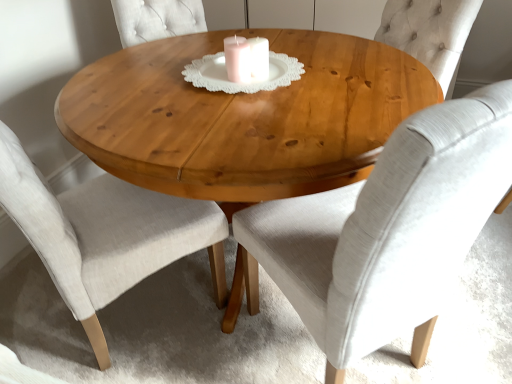
This screenshot has width=512, height=384. Describe the element at coordinates (105, 234) in the screenshot. I see `light beige fabric chair at center, the second chair from the right` at that location.

You are a GUI agent. You are given a task and a screenshot of the screen. Output one action in this format:
    pyautogui.click(x=<x>, y=<y>)
    Task: Click on the light gray fabric chair at center, which is the second chair from left to right
    The image size is (512, 384).
    Given the screenshot: What is the action you would take?
    pyautogui.click(x=387, y=230)

Identify the location of light beige fabric chair at center, the second chair from the right. (105, 234).

In terms of size, does natural wood table at center appear bigger or smaller than light gray fabric chair at center, which is the second chair from left to right?

Clearly, natural wood table at center is larger in size than light gray fabric chair at center, which is the second chair from left to right.

Locate an element on the screen. chair on the right of natural wood table at center is located at coordinates (387, 230).

Is light beige fabric chair at center, positioned as the first chair in left-to-right order, facing towards natural wood table at center?

Yes.

What's the angular difference between light beige fabric chair at center, positioned as the first chair in left-to-right order, and natural wood table at center's facing directions?

The facing directions of light beige fabric chair at center, positioned as the first chair in left-to-right order, and natural wood table at center are 148 degrees apart.

Is light beige fabric chair at center, the second chair from the right, inside the boundaries of natural wood table at center, or outside?

light beige fabric chair at center, the second chair from the right, lies within the bounds of natural wood table at center.

Is the position of light gray fabric chair at center, which is counted as the 1th chair, starting from the right, more distant than that of natural wood table at center?

No, light gray fabric chair at center, which is counted as the 1th chair, starting from the right, is closer to the camera.

Who is shorter, light gray fabric chair at center, which is the second chair from left to right, or natural wood table at center?

Standing shorter between the two is natural wood table at center.

In the scene shown: Can you confirm if light gray fabric chair at center, which is counted as the 1th chair, starting from the right, is smaller than natural wood table at center?

Yes, light gray fabric chair at center, which is counted as the 1th chair, starting from the right, is smaller than natural wood table at center.

Which chair is the 2nd one when counting from the front of the natural wood table at center? Please provide its 2D coordinates.

[(387, 230)]

From a real-world perspective, is light gray fabric chair at center, which is the second chair from left to right, positioned under light beige fabric chair at center, the second chair from the right, based on gravity?

No, from a real-world perspective, light gray fabric chair at center, which is the second chair from left to right, is not below light beige fabric chair at center, the second chair from the right.

From the picture: Which object is closer to the camera, light gray fabric chair at center, which is the second chair from left to right, or light beige fabric chair at center, positioned as the first chair in left-to-right order?

light gray fabric chair at center, which is the second chair from left to right.

Is light gray fabric chair at center, which is counted as the 1th chair, starting from the right, directly adjacent to light beige fabric chair at center, the second chair from the right?

No, light gray fabric chair at center, which is counted as the 1th chair, starting from the right, is not touching light beige fabric chair at center, the second chair from the right.

From the picture: Is natural wood table at center positioned with its back to light beige fabric chair at center, positioned as the first chair in left-to-right order?

No, light beige fabric chair at center, positioned as the first chair in left-to-right order, is not at the back of natural wood table at center.

Which is behind, natural wood table at center or light beige fabric chair at center, positioned as the first chair in left-to-right order?

natural wood table at center is behind.

Is light beige fabric chair at center, positioned as the first chair in left-to-right order, located within natural wood table at center?

Yes, natural wood table at center is surrounding light beige fabric chair at center, positioned as the first chair in left-to-right order.

Where is `chair that is the 1st one above the natural wood table at center (from a real-world perspective)`? chair that is the 1st one above the natural wood table at center (from a real-world perspective) is located at coordinates (105, 234).

Is light beige fabric chair at center, the second chair from the right, not close to light gray fabric chair at center, which is the second chair from left to right?

They are positioned close to each other.

Is light beige fabric chair at center, positioned as the first chair in left-to-right order, aimed at light gray fabric chair at center, which is counted as the 1th chair, starting from the right?

No, light beige fabric chair at center, positioned as the first chair in left-to-right order, does not turn towards light gray fabric chair at center, which is counted as the 1th chair, starting from the right.

Does light beige fabric chair at center, the second chair from the right, appear on the left side of light gray fabric chair at center, which is the second chair from left to right?

Yes.

Where is `chair to the right of natural wood table at center`? Image resolution: width=512 pixels, height=384 pixels. chair to the right of natural wood table at center is located at coordinates (387, 230).

Identify the location of chair on the left of natural wood table at center. Image resolution: width=512 pixels, height=384 pixels. (105, 234).

Estimate the real-world distances between objects in this image. Which object is further from light beige fabric chair at center, the second chair from the right, light gray fabric chair at center, which is the second chair from left to right, or natural wood table at center?

The object further to light beige fabric chair at center, the second chair from the right, is light gray fabric chair at center, which is the second chair from left to right.

Estimate the real-world distances between objects in this image. Which object is closer to light beige fabric chair at center, the second chair from the right, natural wood table at center or light gray fabric chair at center, which is counted as the 1th chair, starting from the right?

Based on the image, natural wood table at center appears to be nearer to light beige fabric chair at center, the second chair from the right.

From the picture: Based on their spatial positions, is light beige fabric chair at center, the second chair from the right, or natural wood table at center closer to light gray fabric chair at center, which is the second chair from left to right?

The object closer to light gray fabric chair at center, which is the second chair from left to right, is natural wood table at center.

When comparing their distances from natural wood table at center, does light beige fabric chair at center, the second chair from the right, or light gray fabric chair at center, which is counted as the 1th chair, starting from the right, seem further?

light beige fabric chair at center, the second chair from the right, is positioned further to the anchor natural wood table at center.

Looking at the image, which one is located closer to light gray fabric chair at center, which is the second chair from left to right, natural wood table at center or light beige fabric chair at center, the second chair from the right?

natural wood table at center is positioned closer to the anchor light gray fabric chair at center, which is the second chair from left to right.

Considering their positions, is light gray fabric chair at center, which is counted as the 1th chair, starting from the right, positioned closer to natural wood table at center than light beige fabric chair at center, positioned as the first chair in left-to-right order?

Based on the image, light gray fabric chair at center, which is counted as the 1th chair, starting from the right, appears to be nearer to natural wood table at center.

Image resolution: width=512 pixels, height=384 pixels. What are the coordinates of `coffee table located between light beige fabric chair at center, positioned as the first chair in left-to-right order, and light gray fabric chair at center, which is the second chair from left to right, in the left-right direction` in the screenshot? It's located at (243, 117).